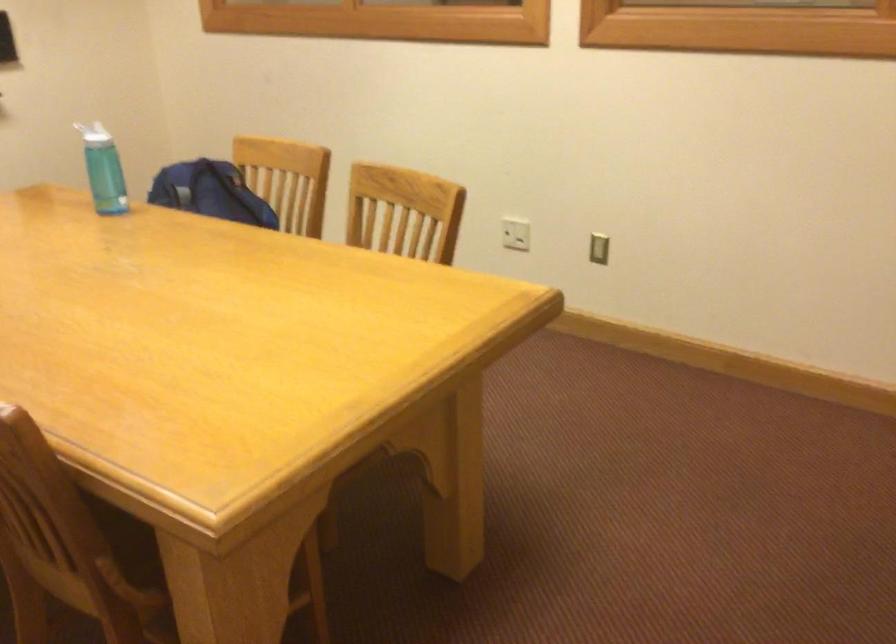
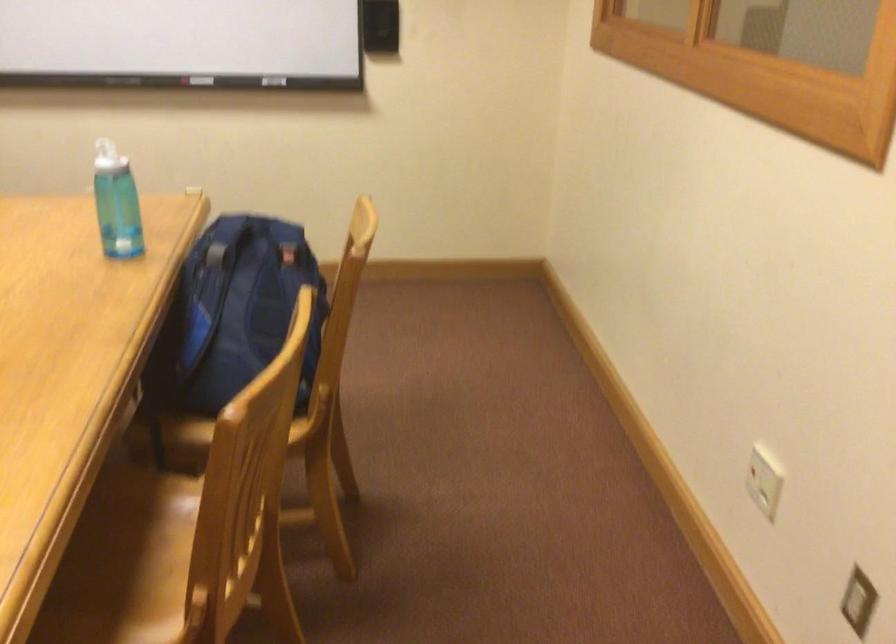
Find the pixel in the second image that matches [191,167] in the first image.

(254, 225)